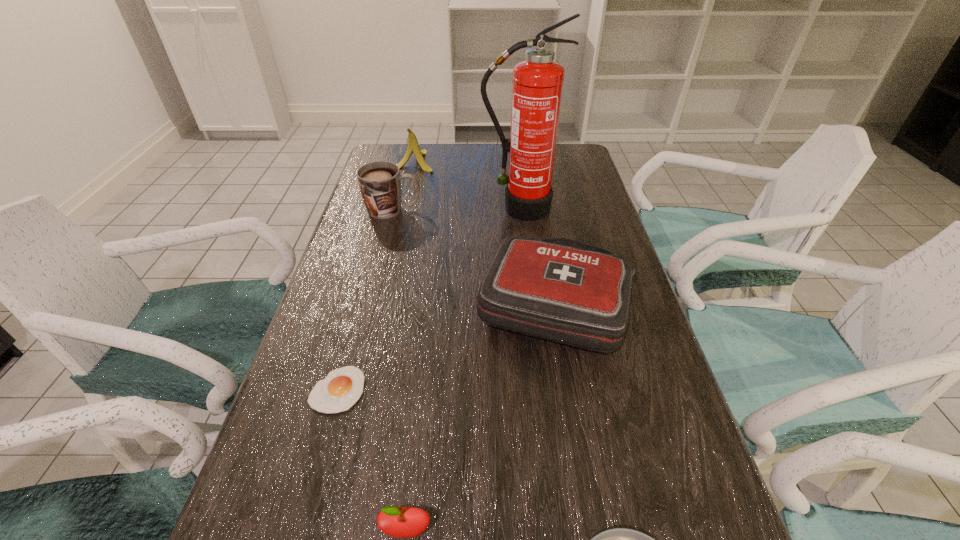
Identify the location of vacant region located 0.290m on the back of the shortest object. Image resolution: width=960 pixels, height=540 pixels. (371, 274).

Identify the location of object that is at the far edge. The height and width of the screenshot is (540, 960). coord(413,146).

The image size is (960, 540). I want to click on banana at the left edge, so click(x=413, y=146).

Locate an element on the screen. mug at the left edge is located at coordinates (380, 182).

The width and height of the screenshot is (960, 540). I want to click on egg yolk that is at the left edge, so click(341, 389).

Where is `fire extinguisher present at the right edge`? This screenshot has width=960, height=540. fire extinguisher present at the right edge is located at coordinates (537, 87).

Locate an element on the screen. The image size is (960, 540). the first-aid kit positioned at the right edge is located at coordinates (558, 289).

In order to click on object that is at the far left corner in this screenshot , I will do `click(413, 146)`.

In order to click on vacant space at the far edge in this screenshot , I will do `click(445, 148)`.

The image size is (960, 540). In order to click on free point at the left edge in this screenshot , I will do `click(281, 400)`.